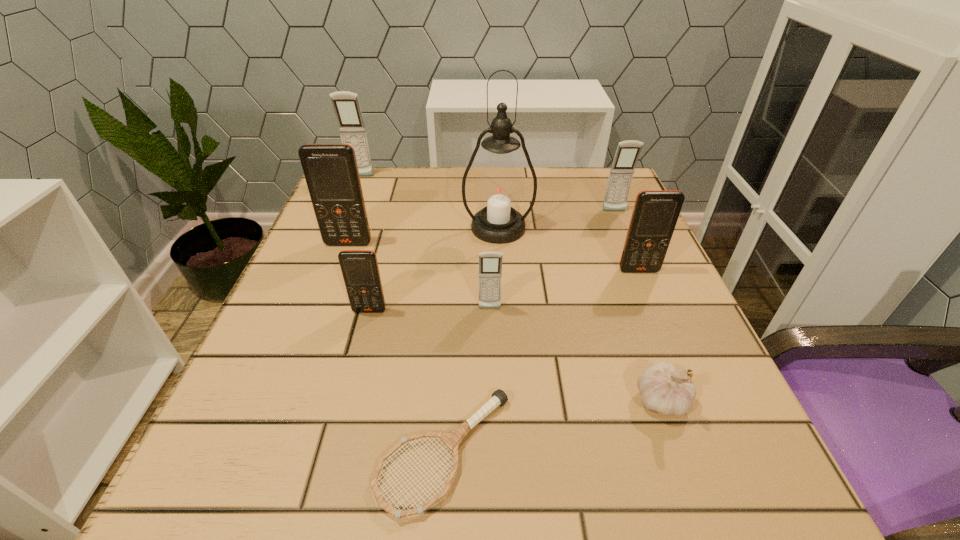
This screenshot has height=540, width=960. What are the coordinates of `the third cellular telephone from left to right` in the screenshot? It's located at (360, 270).

I want to click on the third cellular telephone from right to left, so click(490, 263).

Find the location of a particular element. This screenshot has width=960, height=540. the smallest gray cellular telephone is located at coordinates (490, 263).

You are a GUI agent. You are given a task and a screenshot of the screen. Output one action in this format:
    pyautogui.click(x=<x>, y=<y>)
    Task: Click on the garlic
    
    Given the screenshot: What is the action you would take?
    pyautogui.click(x=664, y=390)

At what (x,y) coordinates should I click in order to perform the action: click on gray tennis racket. Please return your answer as a coordinate pair (x, y). Looking at the image, I should click on (451, 440).

Where is `tennis racket`? tennis racket is located at coordinates (451, 440).

Identify the location of vacant space located 0.160m on the left of the oil lamp. (392, 228).

Image resolution: width=960 pixels, height=540 pixels. Find the location of `vacant point located 0.280m on the front-facing side of the biggest gray cellular telephone`. vacant point located 0.280m on the front-facing side of the biggest gray cellular telephone is located at coordinates (332, 243).

Locate an element on the screen. free location located 0.370m on the screen of the leftmost orange cellular telephone is located at coordinates (291, 397).

Identify the location of blank space located 0.300m on the front-facing side of the rightmost gray cellular telephone. (654, 303).